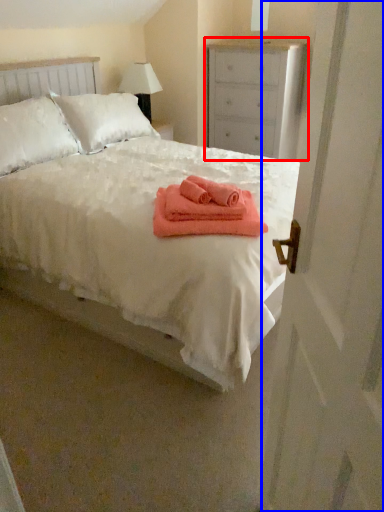
Question: Which object appears farthest to the camera in this image, chest of drawers (highlighted by a red box) or screen door (highlighted by a blue box)?

Choices:
 (A) chest of drawers
 (B) screen door

Answer: (A)